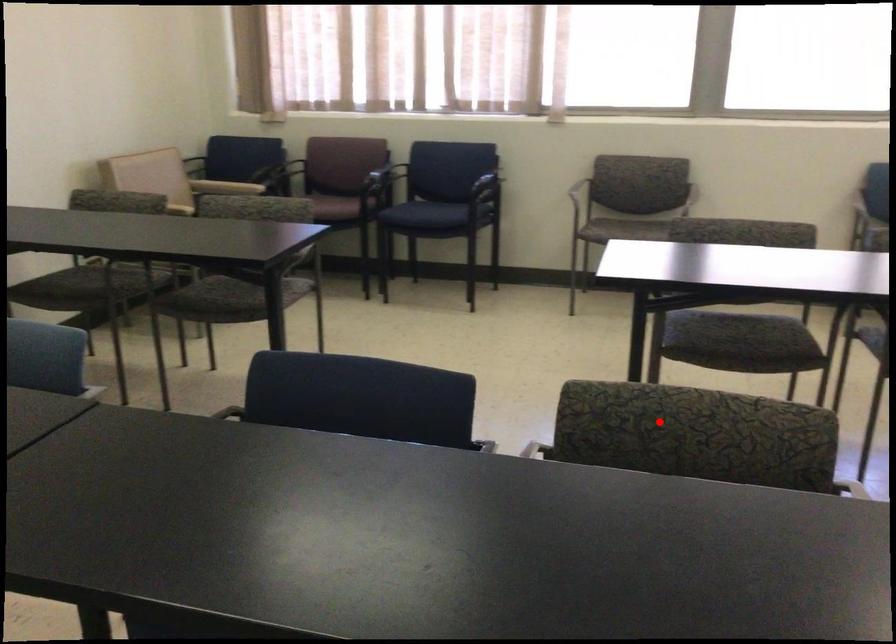
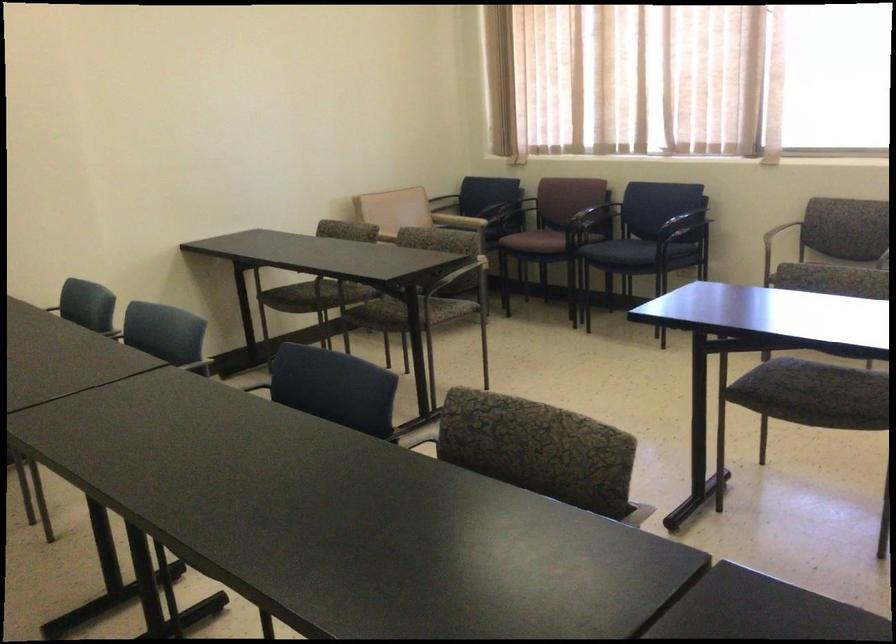
Find the pixel in the second image that matches the highlighted location in the first image.

(538, 449)